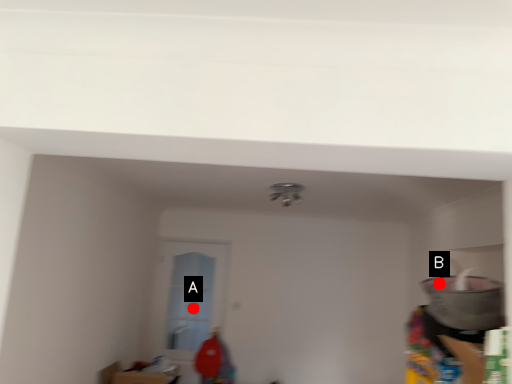
Question: Two points are circled on the image, labeled by A and B beside each circle. Which point is closer to the camera?

Choices:
 (A) A is closer
 (B) B is closer

Answer: (B)